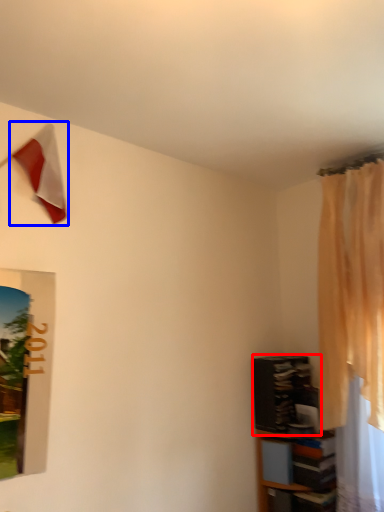
Question: Which of the following is the farthest to the observer, shelf (highlighted by a red box) or flag (highlighted by a blue box)?

Choices:
 (A) shelf
 (B) flag

Answer: (A)